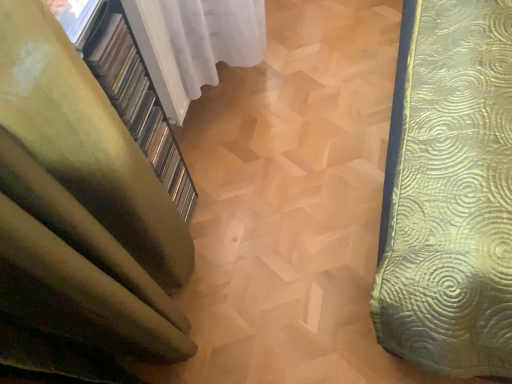
Question: Should I look upward or downward to see white sheer curtain at upper left, positioned as the second curtain in bottom-to-top order?

Choices:
 (A) up
 (B) down

Answer: (A)

Question: Considering the relative positions of white sheer curtain at upper left, positioned as the second curtain in bottom-to-top order, and green fabric curtain at left, the 1th curtain in the bottom-to-top sequence, in the image provided, is white sheer curtain at upper left, positioned as the second curtain in bottom-to-top order, behind green fabric curtain at left, the 1th curtain in the bottom-to-top sequence,?

Choices:
 (A) yes
 (B) no

Answer: (A)

Question: Is white sheer curtain at upper left, positioned as the second curtain in bottom-to-top order, in front of green fabric curtain at left, the 1th curtain in the bottom-to-top sequence?

Choices:
 (A) yes
 (B) no

Answer: (B)

Question: Considering the relative sizes of white sheer curtain at upper left, positioned as the second curtain in bottom-to-top order, and green fabric curtain at left, the 1th curtain in the bottom-to-top sequence, in the image provided, is white sheer curtain at upper left, positioned as the second curtain in bottom-to-top order, taller than green fabric curtain at left, the 1th curtain in the bottom-to-top sequence,?

Choices:
 (A) yes
 (B) no

Answer: (B)

Question: From the image's perspective, is white sheer curtain at upper left, the 1th curtain when ordered from top to bottom, beneath green fabric curtain at left, the 1th curtain in the bottom-to-top sequence?

Choices:
 (A) yes
 (B) no

Answer: (B)

Question: Does white sheer curtain at upper left, positioned as the second curtain in bottom-to-top order, appear on the right side of green fabric curtain at left, the 1th curtain in the bottom-to-top sequence?

Choices:
 (A) yes
 (B) no

Answer: (A)

Question: Does white sheer curtain at upper left, the 1th curtain when ordered from top to bottom, have a smaller size compared to green fabric curtain at left, which appears as the 2th curtain when viewed from the top?

Choices:
 (A) yes
 (B) no

Answer: (A)

Question: Can you confirm if white sheer curtain at upper left, positioned as the second curtain in bottom-to-top order, is shorter than transparent glass window at upper left?

Choices:
 (A) no
 (B) yes

Answer: (A)

Question: From the image's perspective, does white sheer curtain at upper left, positioned as the second curtain in bottom-to-top order, appear lower than transparent glass window at upper left?

Choices:
 (A) no
 (B) yes

Answer: (A)

Question: From a real-world perspective, is white sheer curtain at upper left, positioned as the second curtain in bottom-to-top order, located beneath transparent glass window at upper left?

Choices:
 (A) no
 (B) yes

Answer: (B)

Question: Is white sheer curtain at upper left, positioned as the second curtain in bottom-to-top order, oriented towards transparent glass window at upper left?

Choices:
 (A) yes
 (B) no

Answer: (B)

Question: Can you confirm if white sheer curtain at upper left, positioned as the second curtain in bottom-to-top order, is bigger than transparent glass window at upper left?

Choices:
 (A) yes
 (B) no

Answer: (A)

Question: Considering the relative sizes of white sheer curtain at upper left, the 1th curtain when ordered from top to bottom, and transparent glass window at upper left in the image provided, is white sheer curtain at upper left, the 1th curtain when ordered from top to bottom, taller than transparent glass window at upper left?

Choices:
 (A) yes
 (B) no

Answer: (A)

Question: Is green fabric curtain at left, the 1th curtain in the bottom-to-top sequence, taller than transparent glass window at upper left?

Choices:
 (A) yes
 (B) no

Answer: (A)